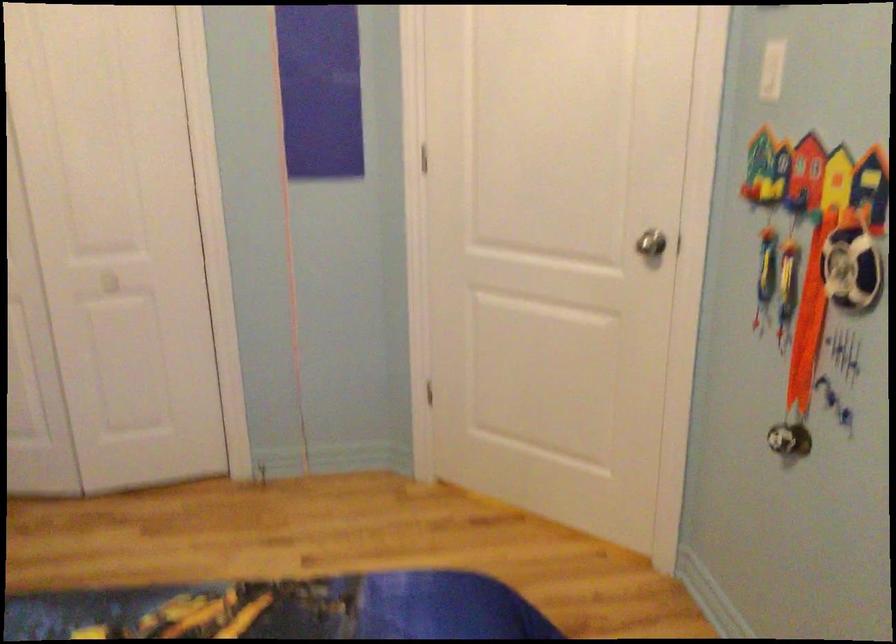
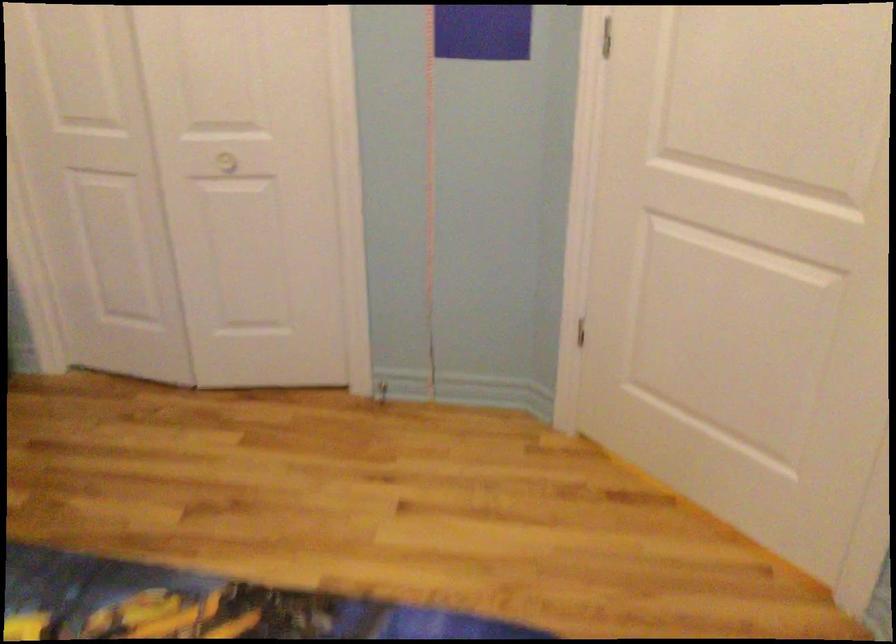
Find the pixel in the second image that matches point 104,286 in the first image.

(227, 162)